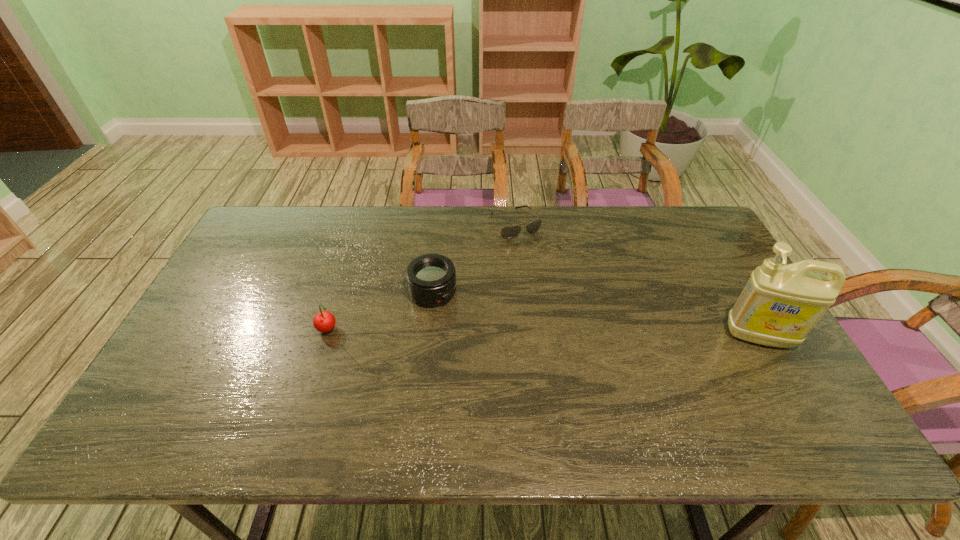
The image size is (960, 540). Identify the location of free space between the second farthest object and the shortest object. (474, 258).

Locate an element on the screen. The image size is (960, 540). object that is the third closest to the tallest object is located at coordinates (324, 321).

Identify which object is located as the second nearest to the cherry. Please provide its 2D coordinates. Your answer should be formatted as a tuple, i.e. [(x, y)], where the tuple contains the x and y coordinates of a point satisfying the conditions above.

[(509, 232)]

I want to click on vacant space that satisfies the following two spatial constraints: 1. on the back side of the shortest object; 2. on the right side of the third tallest object, so click(x=441, y=224).